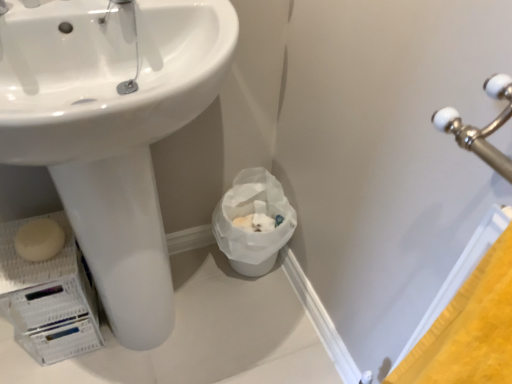
Question: Is white paper bag at lower center touching white glossy sink at center?

Choices:
 (A) yes
 (B) no

Answer: (B)

Question: Is white paper bag at lower center behind white glossy sink at center?

Choices:
 (A) yes
 (B) no

Answer: (A)

Question: From a real-world perspective, is white paper bag at lower center under white glossy sink at center?

Choices:
 (A) yes
 (B) no

Answer: (A)

Question: Is white paper bag at lower center at the left side of white glossy sink at center?

Choices:
 (A) no
 (B) yes

Answer: (A)

Question: Is white paper bag at lower center oriented towards white glossy sink at center?

Choices:
 (A) no
 (B) yes

Answer: (A)

Question: Is white paper bag at lower center bigger than white glossy sink at center?

Choices:
 (A) no
 (B) yes

Answer: (A)

Question: Is white paper bag at lower center outside of white matte soap at lower left?

Choices:
 (A) yes
 (B) no

Answer: (A)

Question: From the image's perspective, would you say white paper bag at lower center is shown under white matte soap at lower left?

Choices:
 (A) no
 (B) yes

Answer: (B)

Question: Are white paper bag at lower center and white matte soap at lower left located far from each other?

Choices:
 (A) yes
 (B) no

Answer: (B)

Question: Does white paper bag at lower center appear on the left side of white matte soap at lower left?

Choices:
 (A) yes
 (B) no

Answer: (B)

Question: Can you confirm if white paper bag at lower center is wider than white matte soap at lower left?

Choices:
 (A) no
 (B) yes

Answer: (B)

Question: Is white paper bag at lower center bigger than white matte soap at lower left?

Choices:
 (A) no
 (B) yes

Answer: (B)

Question: Are white glossy sink at center and white matte soap at lower left making contact?

Choices:
 (A) no
 (B) yes

Answer: (A)